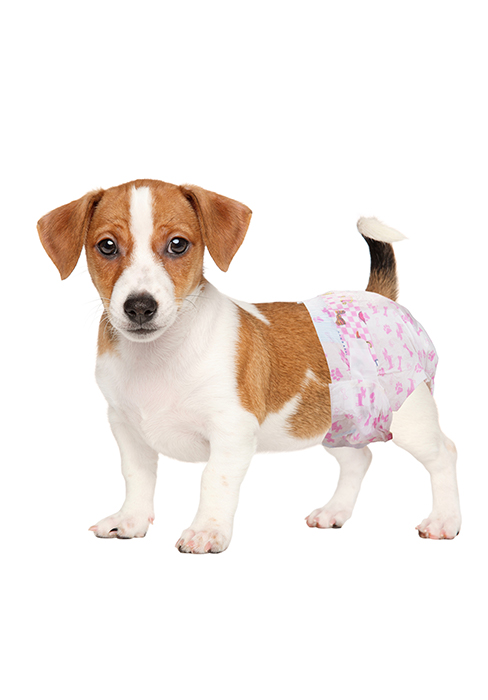
Locate an element on the screen. Image resolution: width=488 pixels, height=700 pixels. white chest is located at coordinates (197, 392).